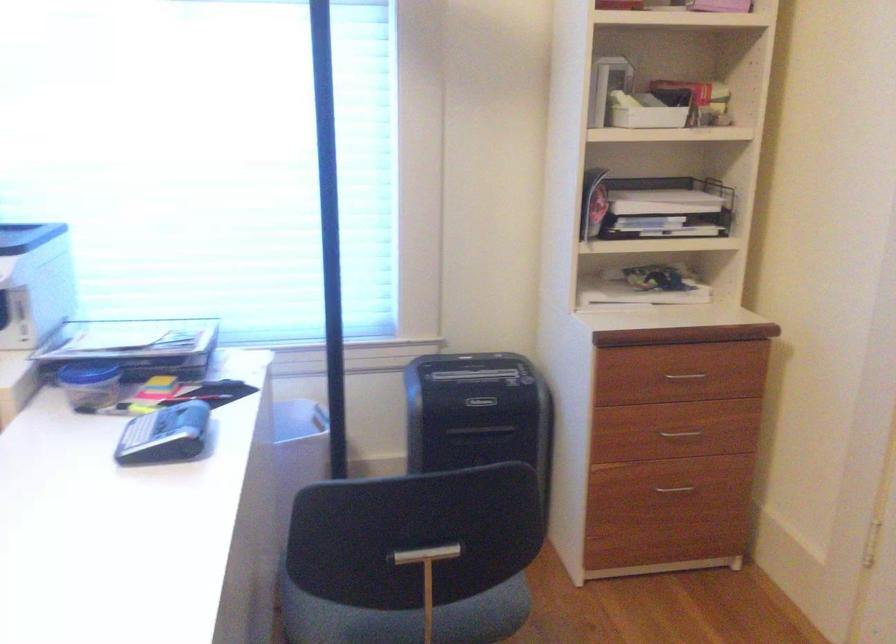
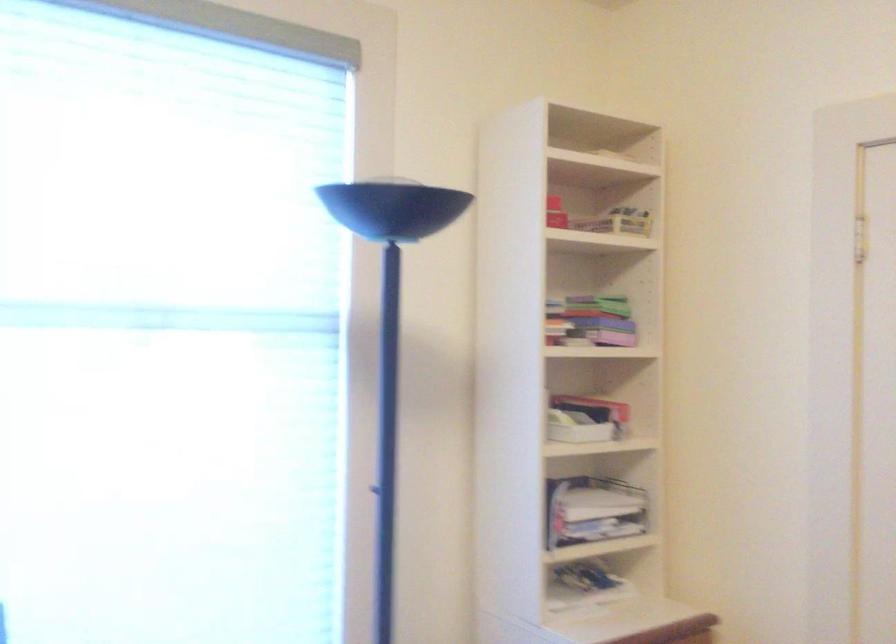
The point at (631, 109) is marked in the first image. Where is the corresponding point in the second image?

(576, 428)